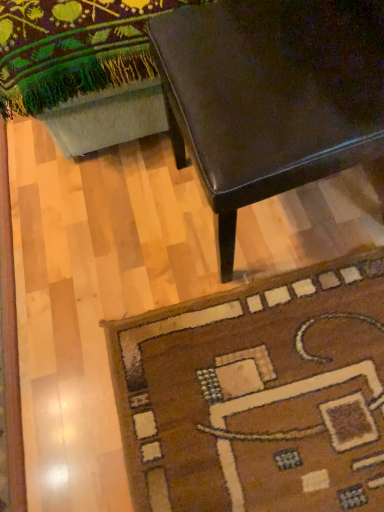
Question: Is shiny dark brown table at upper right at the right side of brown woolen rug at lower right?

Choices:
 (A) yes
 (B) no

Answer: (A)

Question: Does shiny dark brown table at upper right have a smaller size compared to brown woolen rug at lower right?

Choices:
 (A) yes
 (B) no

Answer: (B)

Question: Is shiny dark brown table at upper right looking in the opposite direction of brown woolen rug at lower right?

Choices:
 (A) yes
 (B) no

Answer: (B)

Question: Is shiny dark brown table at upper right bigger than brown woolen rug at lower right?

Choices:
 (A) no
 (B) yes

Answer: (B)

Question: From a real-world perspective, is shiny dark brown table at upper right under brown woolen rug at lower right?

Choices:
 (A) yes
 (B) no

Answer: (B)

Question: Is shiny dark brown table at upper right not within brown woolen rug at lower right?

Choices:
 (A) yes
 (B) no

Answer: (A)

Question: Is brown woolen rug at lower right turned away from shiny dark brown table at upper right?

Choices:
 (A) yes
 (B) no

Answer: (B)

Question: Does brown woolen rug at lower right have a larger size compared to shiny dark brown table at upper right?

Choices:
 (A) no
 (B) yes

Answer: (A)

Question: Is brown woolen rug at lower right positioned in front of shiny dark brown table at upper right?

Choices:
 (A) no
 (B) yes

Answer: (A)

Question: Considering the relative sizes of brown woolen rug at lower right and shiny dark brown table at upper right in the image provided, is brown woolen rug at lower right shorter than shiny dark brown table at upper right?

Choices:
 (A) yes
 (B) no

Answer: (A)

Question: From the image's perspective, is brown woolen rug at lower right located above shiny dark brown table at upper right?

Choices:
 (A) no
 (B) yes

Answer: (A)

Question: Does brown woolen rug at lower right have a lesser width compared to shiny dark brown table at upper right?

Choices:
 (A) no
 (B) yes

Answer: (A)

Question: In the image, is shiny dark brown table at upper right on the left side or the right side of brown woolen rug at lower right?

Choices:
 (A) right
 (B) left

Answer: (A)